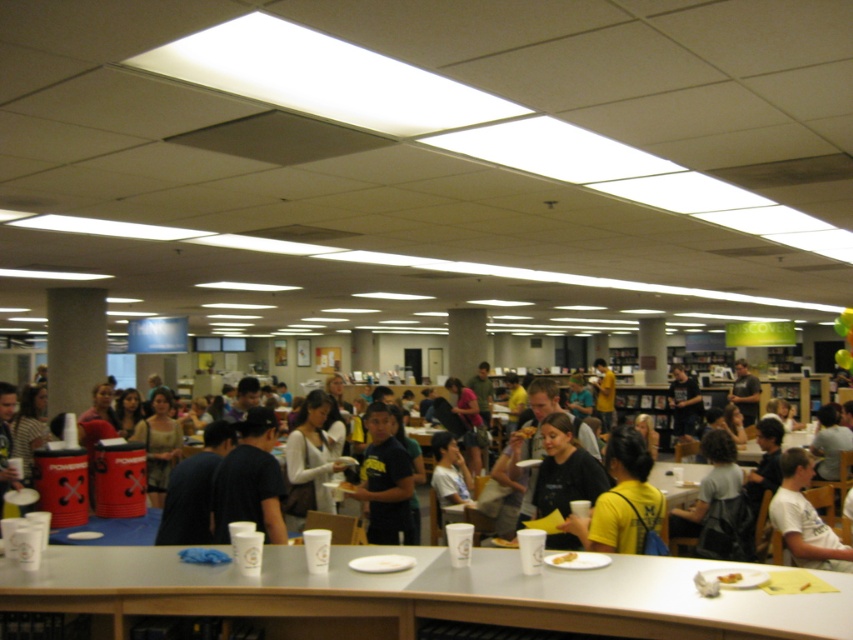
Is dark blue t-shirt at center thinner than white t-shirt at center?

Indeed, dark blue t-shirt at center has a lesser width compared to white t-shirt at center.

How much distance is there between dark blue t-shirt at center and white t-shirt at center?

dark blue t-shirt at center and white t-shirt at center are 6.69 feet apart from each other.

Where is `dark blue t-shirt at center`? dark blue t-shirt at center is located at coordinates (384, 481).

Who is lower down, white plastic cups at center or dark blue t-shirt at center?

white plastic cups at center is below.

Who is positioned more to the right, white plastic cups at center or dark blue t-shirt at center?

Positioned to the right is white plastic cups at center.

Who is more distant from viewer, (x=207, y=612) or (x=363, y=458)?

Point (x=363, y=458)

What are the coordinates of `white plastic cups at center` in the screenshot? It's located at (422, 593).

Who is positioned more to the left, white plastic cups at center or white t-shirt at center?

From the viewer's perspective, white plastic cups at center appears more on the left side.

Does white plastic cups at center have a greater height compared to white t-shirt at center?

No, white plastic cups at center is not taller than white t-shirt at center.

Does point (129, 554) lie behind point (842, 554)?

No, it is in front of (842, 554).

Find the location of a particular element. white plastic cups at center is located at coordinates (422, 593).